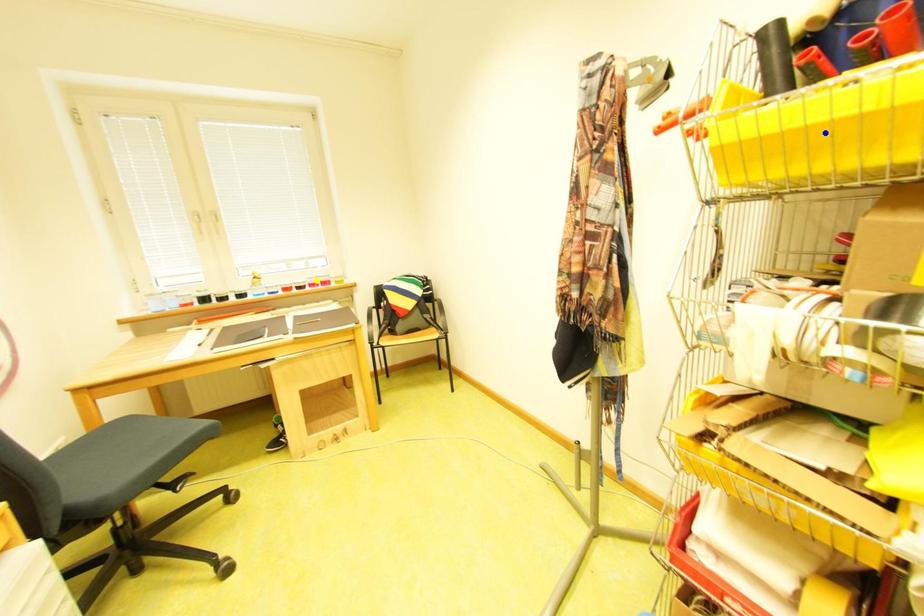
Order these from nearest to farthest:
yellow point | blue point | orange point

blue point, orange point, yellow point